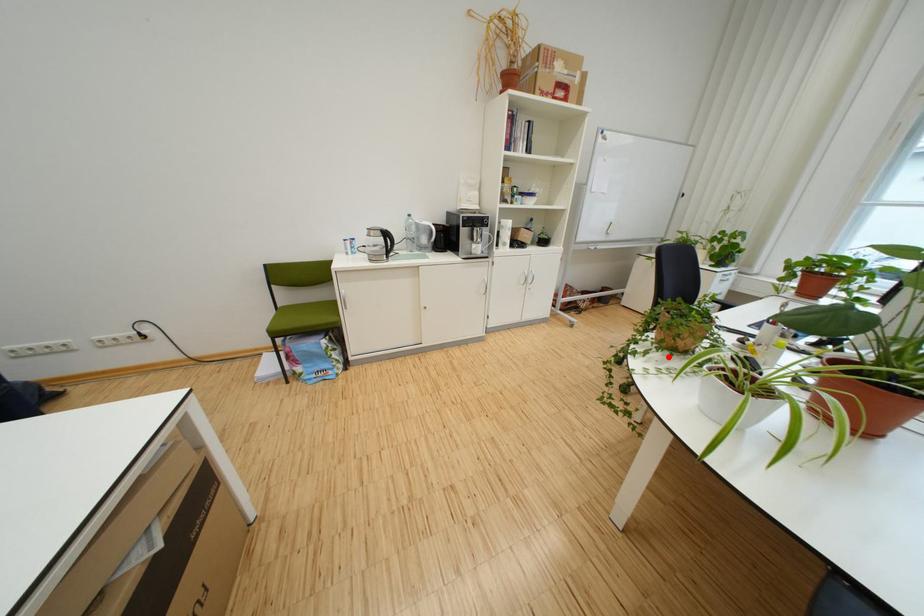
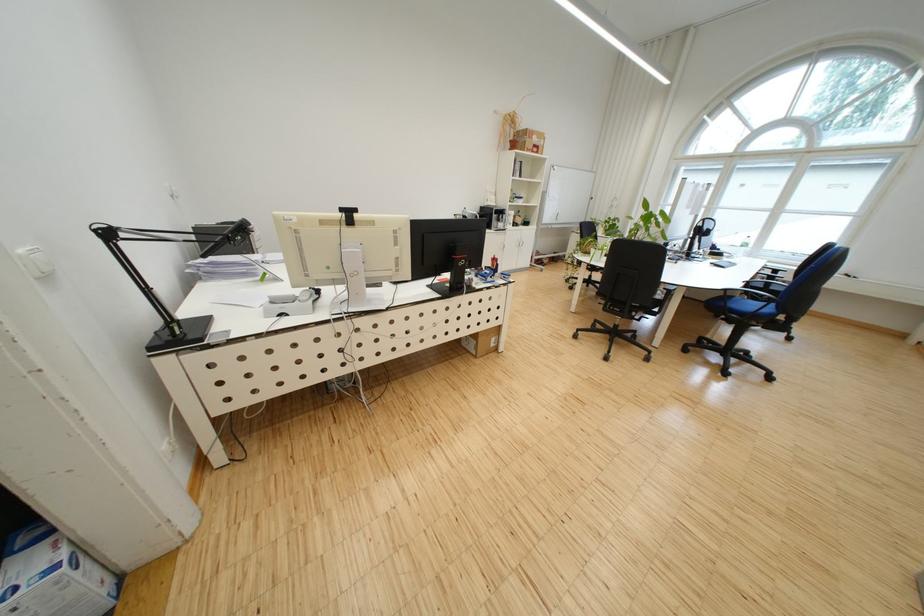
Question: A red point is marked in image1. In image2, is the corresponding 3D point closer to the camera or farther? Reply with the corresponding letter.

Choices:
 (A) The corresponding 3D point is closer.
 (B) The corresponding 3D point is farther.

Answer: (A)